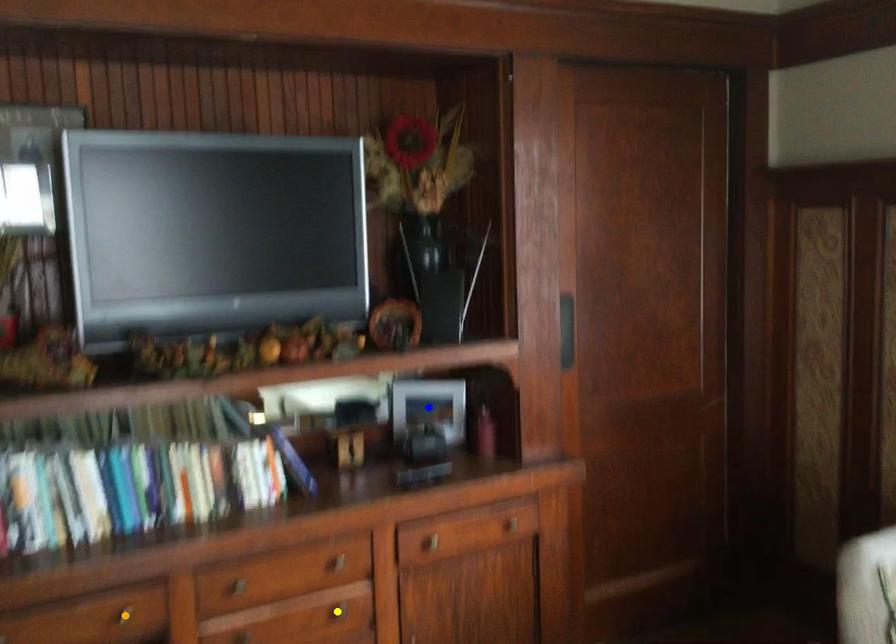
Order these from nearest to farthest:
blue point, orange point, yellow point

orange point < yellow point < blue point